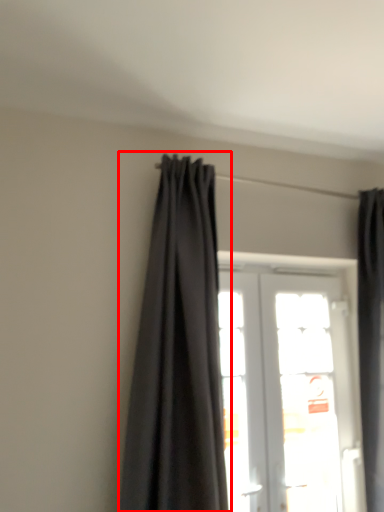
Question: From the image's perspective, where is curtain (annotated by the red box) located in relation to door in the image?

Choices:
 (A) above
 (B) below

Answer: (A)